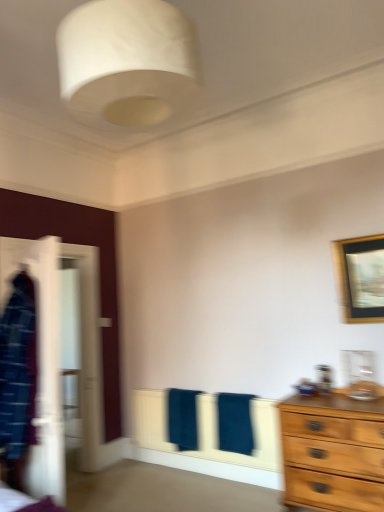
What do you see at coordinates (360, 278) in the screenshot? The height and width of the screenshot is (512, 384). I see `wooden framed picture at upper right` at bounding box center [360, 278].

In order to face white glossy wardrobe at left, should I rotate leftwards or rightwards?

It's best to rotate left around 18.350 degrees.

Where is `white fabric lampshade at upper center`? This screenshot has height=512, width=384. white fabric lampshade at upper center is located at coordinates (127, 61).

The image size is (384, 512). What do you see at coordinates (182, 419) in the screenshot?
I see `dark blue towel at center, positioned as the 1th bath towel in left-to-right order` at bounding box center [182, 419].

Find the location of `wooden framed picture at upper right`. wooden framed picture at upper right is located at coordinates (360, 278).

From a real-world perspective, which is physically above, dark blue towel at center, marked as the second bath towel in a right-to-left arrangement, or white glossy wardrobe at left?

white glossy wardrobe at left, from a real-world perspective.

Which of these two, dark blue towel at center, marked as the second bath towel in a right-to-left arrangement, or white glossy wardrobe at left, is bigger?

With larger size is white glossy wardrobe at left.

Is point (182, 400) closer to camera compared to point (98, 301)?

Yes, point (182, 400) is in front of point (98, 301).

Is white fabric lampshade at upper center touching white glossy wardrobe at left?

No, white fabric lampshade at upper center is not with white glossy wardrobe at left.

Who is shorter, white fabric lampshade at upper center or white glossy wardrobe at left?

With less height is white fabric lampshade at upper center.

Is white fabric lampshade at upper center bigger or smaller than white glossy wardrobe at left?

white fabric lampshade at upper center is smaller than white glossy wardrobe at left.

Can you tell me how much white fabric lampshade at upper center and dark blue towel at center, which appears as the 1th bath towel when viewed from the right, differ in facing direction?

90 degrees separate the facing orientations of white fabric lampshade at upper center and dark blue towel at center, which appears as the 1th bath towel when viewed from the right.

Is white fabric lampshade at upper center positioned with its back to dark blue towel at center, the 2th bath towel in the left-to-right sequence?

No, white fabric lampshade at upper center's orientation is not away from dark blue towel at center, the 2th bath towel in the left-to-right sequence.

This screenshot has width=384, height=512. What are the coordinates of `light fixture located above the dark blue towel at center, the 2th bath towel in the left-to-right sequence (from a real-world perspective)` in the screenshot? It's located at 127,61.

Considering the points (66, 71) and (222, 410), which point is behind, point (66, 71) or point (222, 410)?

The point (222, 410) is more distant.

Is dark blue towel at center, the 2th bath towel in the left-to-right sequence, positioned far away from white glossy wardrobe at left?

Yes, dark blue towel at center, the 2th bath towel in the left-to-right sequence, is far from white glossy wardrobe at left.

What's the angular difference between dark blue towel at center, the 2th bath towel in the left-to-right sequence, and white glossy wardrobe at left's facing directions?

The angular difference between dark blue towel at center, the 2th bath towel in the left-to-right sequence, and white glossy wardrobe at left is 90.9 degrees.

Does dark blue towel at center, which appears as the 1th bath towel when viewed from the right, have a greater width compared to white glossy wardrobe at left?

Yes.

From a real-world perspective, between dark blue towel at center, the 2th bath towel in the left-to-right sequence, and white glossy wardrobe at left, who is vertically higher?

white glossy wardrobe at left is physically above.

Is dark blue towel at center, positioned as the 1th bath towel in left-to-right order, wider than white fabric lampshade at upper center?

Incorrect, the width of dark blue towel at center, positioned as the 1th bath towel in left-to-right order, does not surpass that of white fabric lampshade at upper center.

Is dark blue towel at center, marked as the second bath towel in a right-to-left arrangement, oriented away from white fabric lampshade at upper center?

No, dark blue towel at center, marked as the second bath towel in a right-to-left arrangement, is not facing the opposite direction of white fabric lampshade at upper center.

Which is in front, point (178, 403) or point (118, 76)?

The point (118, 76) is in front.

In the scene shown: Based on their sizes in the image, would you say dark blue towel at center, marked as the second bath towel in a right-to-left arrangement, is bigger or smaller than white fabric lampshade at upper center?

Clearly, dark blue towel at center, marked as the second bath towel in a right-to-left arrangement, is smaller in size than white fabric lampshade at upper center.

Is the surface of white glossy wardrobe at left in direct contact with dark blue towel at center, marked as the second bath towel in a right-to-left arrangement?

No, white glossy wardrobe at left is not next to dark blue towel at center, marked as the second bath towel in a right-to-left arrangement.

Considering the positions of objects white glossy wardrobe at left and dark blue towel at center, marked as the second bath towel in a right-to-left arrangement, in the image provided, who is in front, white glossy wardrobe at left or dark blue towel at center, marked as the second bath towel in a right-to-left arrangement,?

Positioned in front is white glossy wardrobe at left.

Is dark blue towel at center, positioned as the 1th bath towel in left-to-right order, surrounded by white glossy wardrobe at left?

Definitely not — dark blue towel at center, positioned as the 1th bath towel in left-to-right order, is not inside white glossy wardrobe at left.

Does point (39, 340) come behind point (184, 405)?

No, it is not.

Between wooden framed picture at upper right and dark blue towel at center, which appears as the 1th bath towel when viewed from the right, which one has more height?

wooden framed picture at upper right is taller.

Does point (382, 306) lie behind point (229, 436)?

No, (382, 306) is closer to viewer.

Is wooden framed picture at upper right bigger or smaller than dark blue towel at center, which appears as the 1th bath towel when viewed from the right?

Clearly, wooden framed picture at upper right is smaller in size than dark blue towel at center, which appears as the 1th bath towel when viewed from the right.

Is wooden framed picture at upper right turned away from dark blue towel at center, the 2th bath towel in the left-to-right sequence?

No, wooden framed picture at upper right's orientation is not away from dark blue towel at center, the 2th bath towel in the left-to-right sequence.

At what (x,y) coordinates should I click in order to perform the action: click on closet that appears above the dark blue towel at center, marked as the second bath towel in a right-to-left arrangement (from a real-world perspective). Please return your answer as a coordinate pair (x, y). Looking at the image, I should click on (60, 357).

Where is `light fixture located in front of the white glossy wardrobe at left`? This screenshot has width=384, height=512. light fixture located in front of the white glossy wardrobe at left is located at coordinates (127, 61).

Based on their spatial positions, is wooden framed picture at upper right or white glossy wardrobe at left further from dark blue towel at center, the 2th bath towel in the left-to-right sequence?

white glossy wardrobe at left is positioned further to the anchor dark blue towel at center, the 2th bath towel in the left-to-right sequence.

Estimate the real-world distances between objects in this image. Which object is closer to wooden framed picture at upper right, dark blue towel at center, marked as the second bath towel in a right-to-left arrangement, or dark blue towel at center, the 2th bath towel in the left-to-right sequence?

The object closer to wooden framed picture at upper right is dark blue towel at center, the 2th bath towel in the left-to-right sequence.

Consider the image. Considering their positions, is wooden framed picture at upper right positioned further to white glossy wardrobe at left than dark blue towel at center, which appears as the 1th bath towel when viewed from the right?

Among the two, wooden framed picture at upper right is located further to white glossy wardrobe at left.

Which object lies nearer to the anchor point wooden framed picture at upper right, dark blue towel at center, positioned as the 1th bath towel in left-to-right order, or white glossy wardrobe at left?

dark blue towel at center, positioned as the 1th bath towel in left-to-right order, is positioned closer to the anchor wooden framed picture at upper right.

When comparing their distances from dark blue towel at center, the 2th bath towel in the left-to-right sequence, does wooden framed picture at upper right or dark blue towel at center, marked as the second bath towel in a right-to-left arrangement, seem further?

wooden framed picture at upper right is further to dark blue towel at center, the 2th bath towel in the left-to-right sequence.

Looking at the image, which one is located further to wooden framed picture at upper right, white fabric lampshade at upper center or dark blue towel at center, marked as the second bath towel in a right-to-left arrangement?

white fabric lampshade at upper center is positioned further to the anchor wooden framed picture at upper right.

Which object lies further to the anchor point white glossy wardrobe at left, dark blue towel at center, the 2th bath towel in the left-to-right sequence, or wooden framed picture at upper right?

Among the two, wooden framed picture at upper right is located further to white glossy wardrobe at left.

Looking at the image, which one is located closer to white glossy wardrobe at left, dark blue towel at center, marked as the second bath towel in a right-to-left arrangement, or wooden framed picture at upper right?

The object closer to white glossy wardrobe at left is dark blue towel at center, marked as the second bath towel in a right-to-left arrangement.

Identify the location of bath towel between white fabric lampshade at upper center and dark blue towel at center, positioned as the 1th bath towel in left-to-right order, from top to bottom. (235, 423).

The width and height of the screenshot is (384, 512). I want to click on bath towel between wooden framed picture at upper right and dark blue towel at center, positioned as the 1th bath towel in left-to-right order, in the vertical direction, so [x=235, y=423].

Locate an element on the screen. Image resolution: width=384 pixels, height=512 pixels. picture frame between white fabric lampshade at upper center and dark blue towel at center, marked as the second bath towel in a right-to-left arrangement, in the front-back direction is located at coordinates (360, 278).

This screenshot has width=384, height=512. Identify the location of closet positioned between white fabric lampshade at upper center and dark blue towel at center, marked as the second bath towel in a right-to-left arrangement, from near to far. (60, 357).